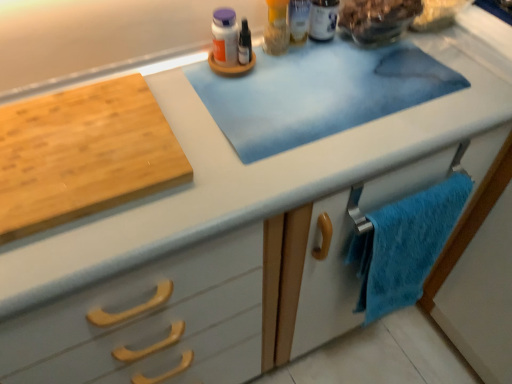
Question: Considering their positions, is natural wood cutting board at left located in front of or behind translucent glass bowl at upper right?

Choices:
 (A) front
 (B) behind

Answer: (A)

Question: Does point pos(46,160) appear closer or farther from the camera than point pos(408,16)?

Choices:
 (A) closer
 (B) farther

Answer: (A)

Question: Which object is the farthest from the natural wood cutting board at left?

Choices:
 (A) white plastic bottle at upper center, marked as the 1th toiletry in a right-to-left arrangement
 (B) blue fuzzy towel at lower right
 (C) translucent plastic container at upper center, placed as the 1th toiletry when sorted from left to right
 (D) translucent glass bowl at upper right

Answer: (D)

Question: Which is nearer to the natural wood cutting board at left?

Choices:
 (A) blue fuzzy towel at lower right
 (B) translucent glass bowl at upper right
 (C) translucent plastic container at upper center, placed as the 1th toiletry when sorted from left to right
 (D) white plastic bottle at upper center, which appears as the 2th toiletry when viewed from the left

Answer: (C)